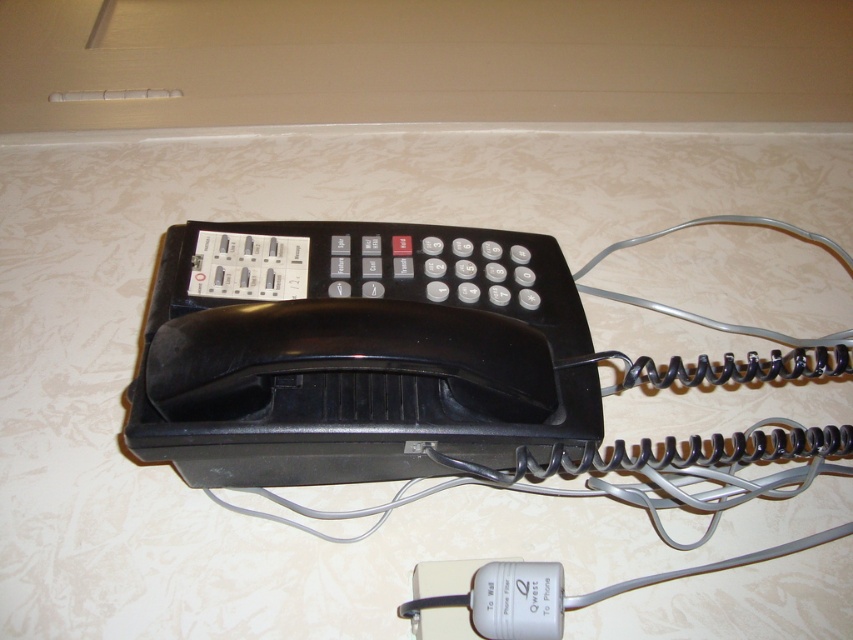
You have a black plastic phone at center and a white plastic power filter at lower center on your desk. You need to place a 8 inch long cable between them. Will it reach?

The black plastic phone at center is 7.97 inches from the white plastic power filter at lower center. Since the cable is 8 inches long, it will just barely reach between them.

You are trying to unplug the black corded telephone from its socket. The plug is located at point [367,312]. However, there is an obstacle at point [546,592] blocking your path. Can you reach the plug without moving the obstacle?

Point [367,312] is behind point [546,592], so you cannot reach the plug without moving the obstacle.

You are setting up a new phone and need to plug it into the power filter. According to the image, where should you place the black plastic phone at center relative to the white plastic power filter at lower center?

The black plastic phone at center should be placed to the left of the white plastic power filter at lower center as shown in the image.